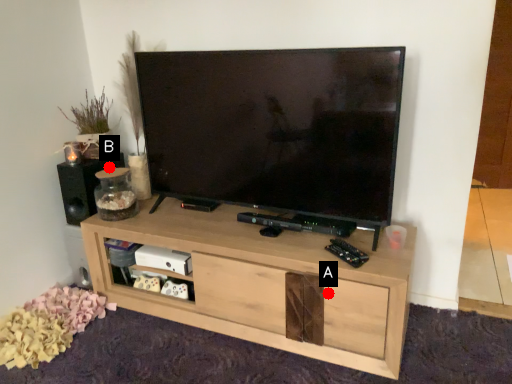
Question: Two points are circled on the image, labeled by A and B beside each circle. Among these points, which one is nearest to the camera?

Choices:
 (A) A is closer
 (B) B is closer

Answer: (A)